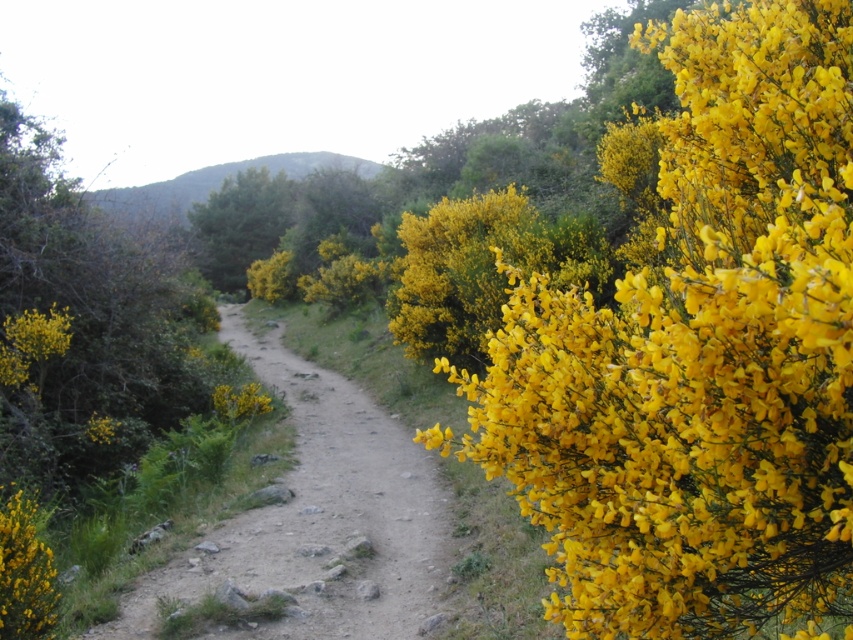
Can you confirm if yellow fluffy bush at right is smaller than dusty brown dirt track at center?

Yes.

Which is more to the left, yellow fluffy bush at right or dusty brown dirt track at center?

dusty brown dirt track at center

Identify the location of yellow fluffy bush at right. The image size is (853, 640). (699, 356).

Locate an element on the screen. yellow fluffy bush at right is located at coordinates (699, 356).

This screenshot has height=640, width=853. What do you see at coordinates (241, 225) in the screenshot? I see `yellow fluffy bush at center` at bounding box center [241, 225].

Locate an element on the screen. This screenshot has width=853, height=640. yellow fluffy bush at center is located at coordinates (241, 225).

Between point (288, 214) and point (254, 161), which one is positioned in front?

Point (288, 214) is in front.

Where is `yellow fluffy bush at center`? The height and width of the screenshot is (640, 853). yellow fluffy bush at center is located at coordinates point(241,225).

The width and height of the screenshot is (853, 640). What do you see at coordinates (699, 356) in the screenshot? I see `yellow fluffy bush at right` at bounding box center [699, 356].

Does yellow fluffy bush at right have a lesser height compared to yellow fluffy bush at center?

No, yellow fluffy bush at right is not shorter than yellow fluffy bush at center.

At what (x,y) coordinates should I click in order to perform the action: click on yellow fluffy bush at right. Please return your answer as a coordinate pair (x, y). Looking at the image, I should click on (699, 356).

The height and width of the screenshot is (640, 853). I want to click on yellow fluffy bush at right, so click(x=699, y=356).